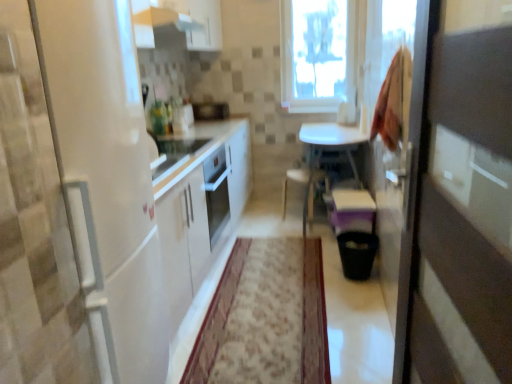
You are a GUI agent. You are given a task and a screenshot of the screen. Output one action in this format:
    pyautogui.click(x=<x>, y=<y>)
    Task: Click on the vacant space behind wooden chair at center
    The image size is (512, 384).
    Given the screenshot: What is the action you would take?
    pyautogui.click(x=283, y=207)